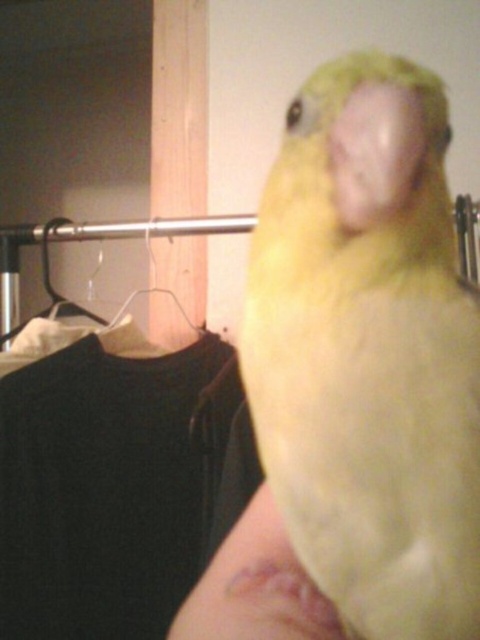
Does yellow matte parrot at center have a lesser width compared to pink flesh at center?

In fact, yellow matte parrot at center might be wider than pink flesh at center.

Can you confirm if yellow matte parrot at center is bigger than pink flesh at center?

Indeed, yellow matte parrot at center has a larger size compared to pink flesh at center.

This screenshot has width=480, height=640. I want to click on yellow matte parrot at center, so click(x=369, y=353).